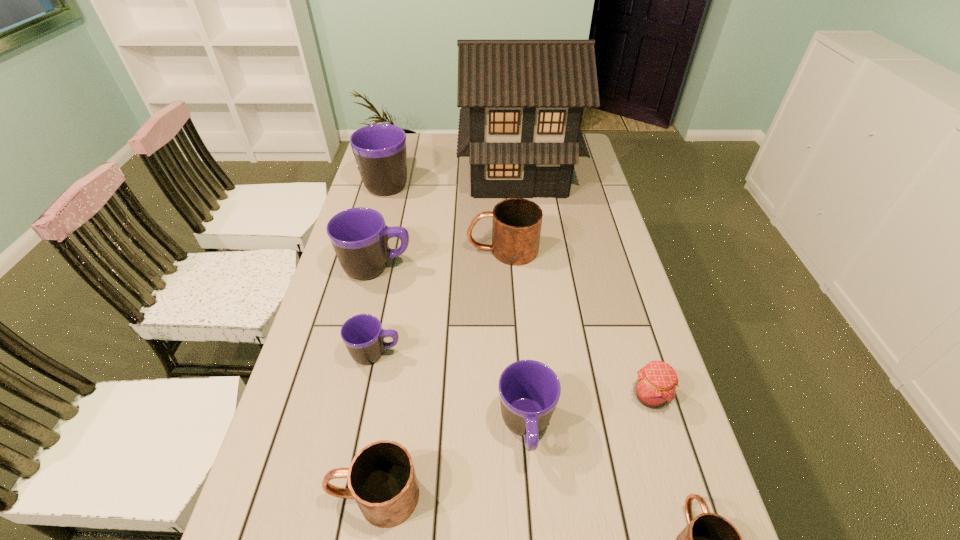
Where is `vacant point located 0.250m on the side of the second rust mug from left to right with the handle`? This screenshot has height=540, width=960. vacant point located 0.250m on the side of the second rust mug from left to right with the handle is located at coordinates (389, 250).

Identify the location of vacant space situated with the handle on the side of the nearest black mug. This screenshot has height=540, width=960. (535, 539).

Locate an element on the screen. This screenshot has height=540, width=960. vacant space located on the side of the second smallest rust mug with the handle is located at coordinates [274, 496].

Find the location of a particular element. The height and width of the screenshot is (540, 960). free space located on the side of the second smallest rust mug with the handle is located at coordinates (279, 496).

Where is `vacant region located on the side of the second smallest rust mug with the handle`? This screenshot has height=540, width=960. vacant region located on the side of the second smallest rust mug with the handle is located at coordinates (284, 496).

What are the coordinates of `free region located 0.220m with the handle on the side of the smallest black mug` in the screenshot? It's located at (489, 354).

Image resolution: width=960 pixels, height=540 pixels. I want to click on free space located on the back of the red jam, so click(x=639, y=362).

Locate an element on the screen. This screenshot has width=960, height=540. object located in the far edge section of the desktop is located at coordinates pyautogui.click(x=522, y=101).

Where is `dollhouse that is at the right edge`? dollhouse that is at the right edge is located at coordinates (522, 101).

Locate an element on the screen. The width and height of the screenshot is (960, 540). jam present at the right edge is located at coordinates (655, 386).